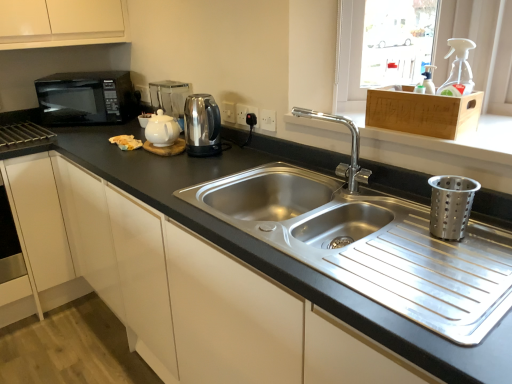
This screenshot has height=384, width=512. I want to click on vacant space in front of stainless steel kettle at center, so click(200, 173).